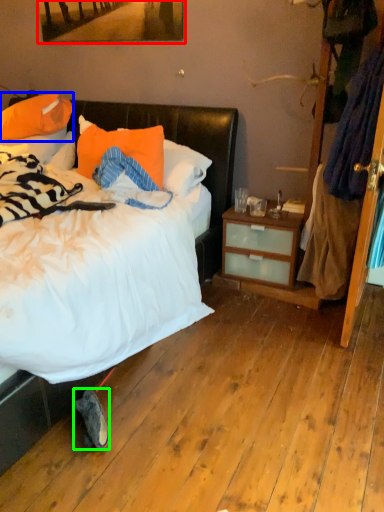
Question: Which object is the closest to the picture frame (highlighted by a red box)? Choose among these: pillow (highlighted by a blue box) or sneakers (highlighted by a green box).

Choices:
 (A) pillow
 (B) sneakers

Answer: (A)